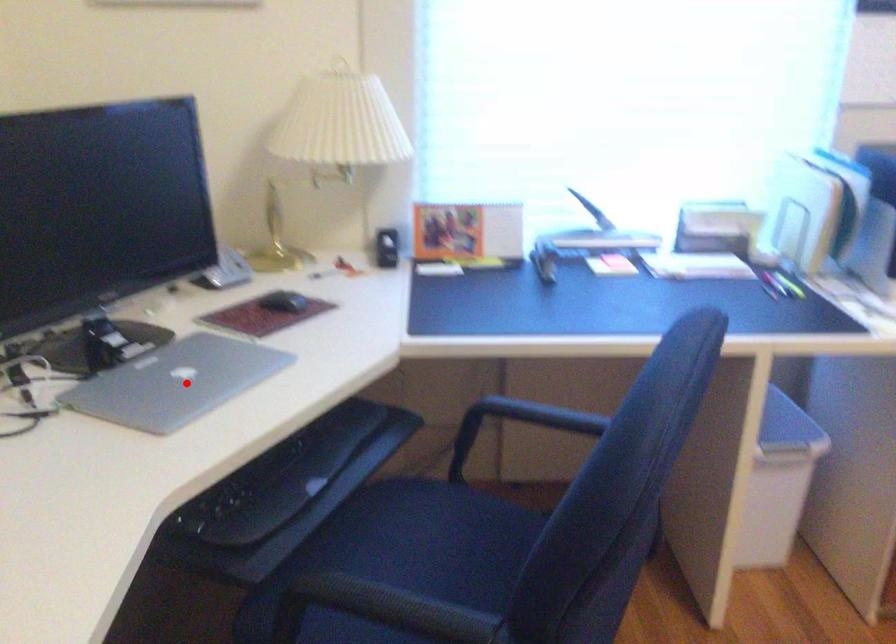
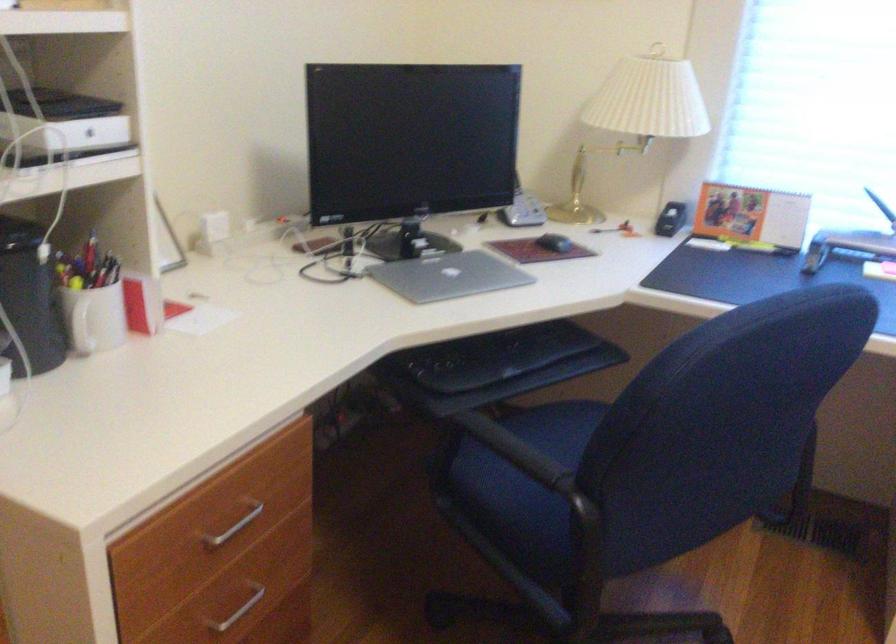
Question: A red point is marked in image1. In image2, is the corresponding 3D point closer to the camera or farther? Reply with the corresponding letter.

Choices:
 (A) The corresponding 3D point is closer.
 (B) The corresponding 3D point is farther.

Answer: (B)